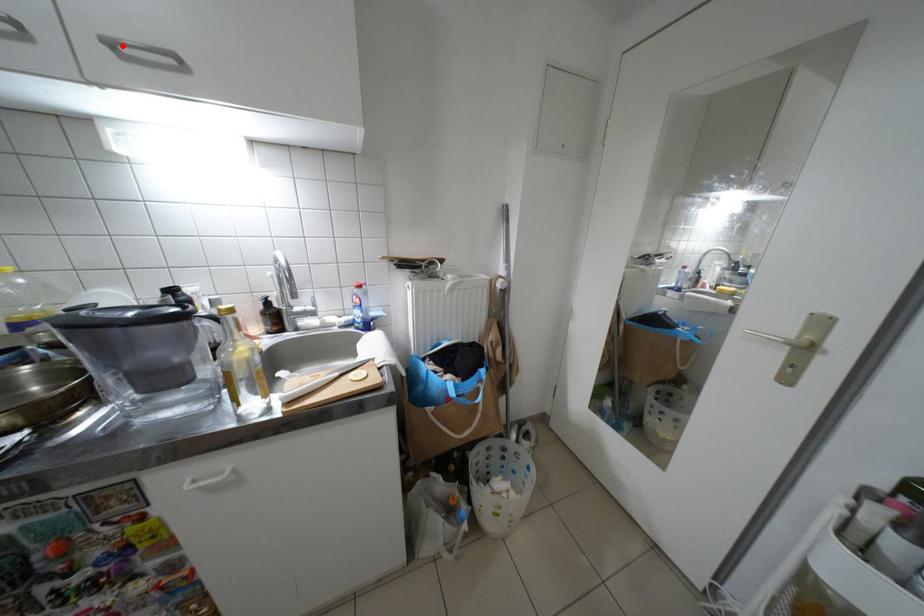
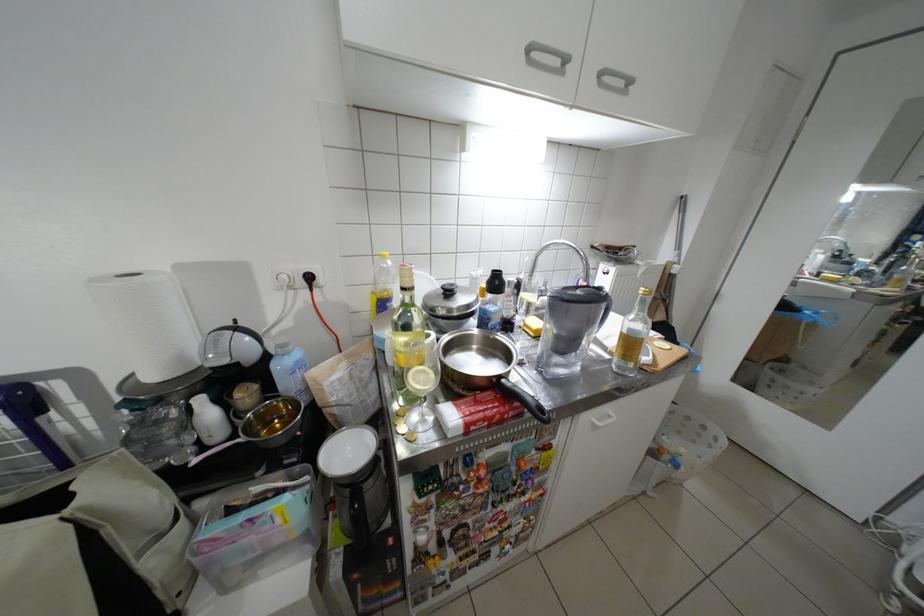
Locate, in the second image, the point that corresponds to the highlighted location in the first image.

(613, 75)